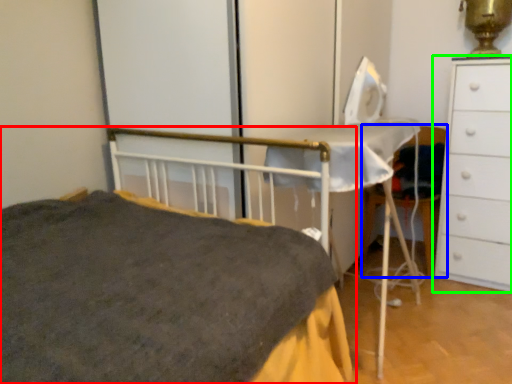
Question: Which object is positioned farthest from bed (highlighted by a red box)? Select from chair (highlighted by a blue box) and chest of drawers (highlighted by a green box).

Choices:
 (A) chair
 (B) chest of drawers

Answer: (A)